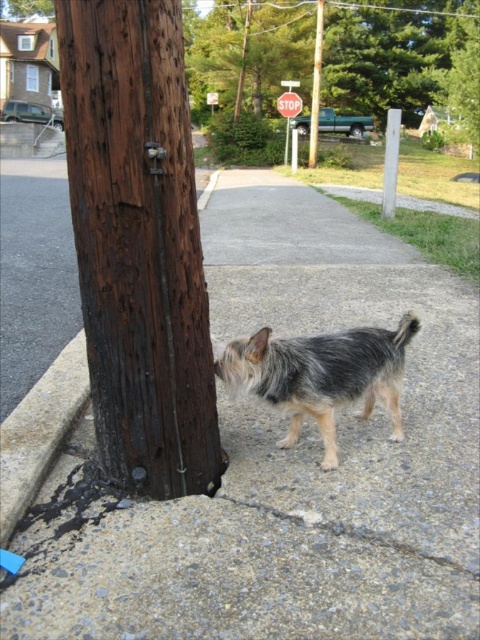
You are a delivery person trying to secure a package to the utility pole and the stop sign post. The dark brown wood at left and the white smooth pole at center are both available. Which pole is lower in height to attach the package?

The dark brown wood at left is located below the white smooth pole at center, so the dark brown wood at left is lower in height and suitable for attaching the package.

You are standing 3 meters away from the gray concrete pavement at lower center. Can you step onto it without moving closer?

The gray concrete pavement at lower center is 3.48 meters away from the viewer. Since you are already 3 meters away, you need to move 0.48 meters closer to reach it, so you cannot step onto it without moving closer.

You are a delivery person holding a package and standing near the white smooth pole at center and the red plastic stop sign at upper center. You need to place the package on the nearest object to you. Which object should you choose?

The white smooth pole at center is closer to the viewer than the red plastic stop sign at upper center, so you should place the package on the white smooth pole at center.